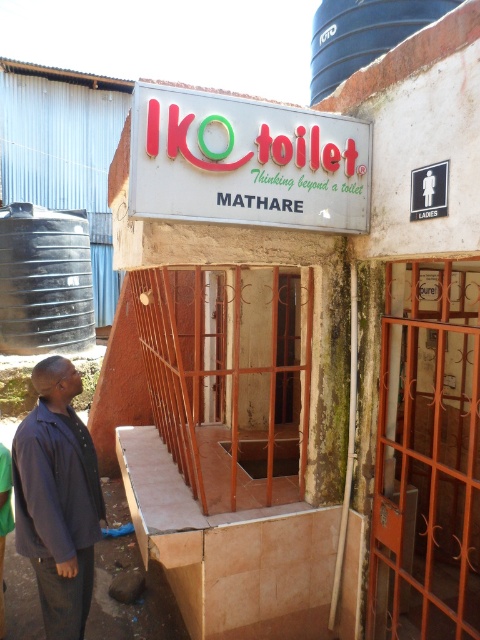
You are standing at the entrance of the public restroom and need to reach the blue plastic silo at upper center. There is a person in a dark blue shirt at lower left blocking your path. Can you walk around them to reach the silo?

The dark blue shirt at lower left is 11.76 feet away from the blue plastic silo at upper center. Since the person is only 11.76 feet away from the silo, you can walk around them to reach the blue plastic silo at upper center.

Consider the image. You are standing in front of the Iko Toilet restroom in Mathare and notice two points marked on the sign. Which point, point 1 at coordinates [63,452] or point 2 at coordinates [78,298], is closer to your current position?

Point 1 at coordinates [63,452] is closer to the camera than point 2 at coordinates [78,298].

You are standing in front of the Iko Toilet restroom in Mathare and need to locate the black plastic water tank at upper left. According to the scene description, where exactly is it positioned relative to the entrance?

The black plastic water tank at upper left is located at point (45, 280) relative to the entrance.